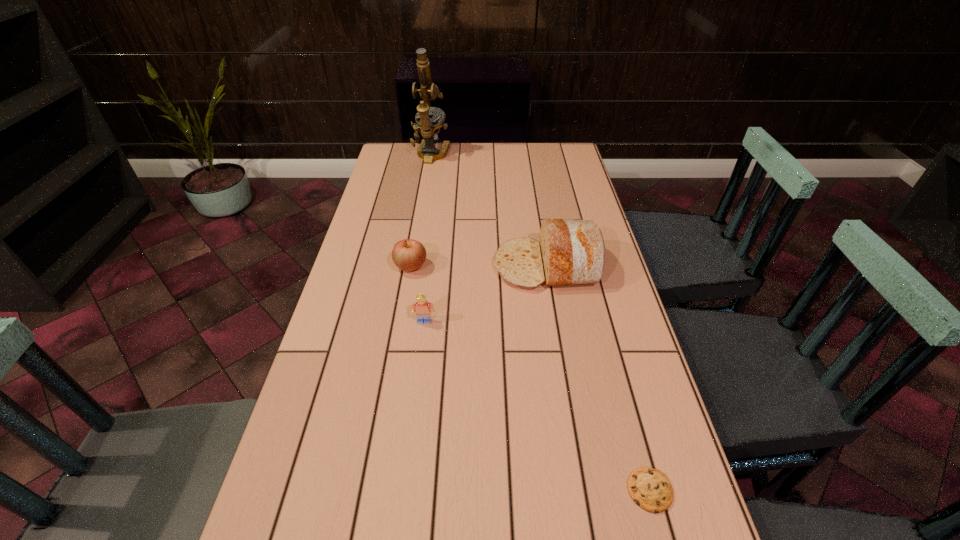
I want to click on unoccupied area between the Lego and the shortest object, so click(537, 406).

Locate an element on the screen. The width and height of the screenshot is (960, 540). vacant point located between the cookie and the apple is located at coordinates (530, 379).

Locate an element on the screen. free space between the Lego and the nearest object is located at coordinates (537, 406).

In order to click on vacant point located between the farthest object and the bread in this screenshot , I will do `click(489, 211)`.

This screenshot has height=540, width=960. Identify the location of free space between the apple and the cookie. (530, 379).

Identify which object is located as the fourth nearest to the second nearest object. Please provide its 2D coordinates. Your answer should be formatted as a tuple, i.e. [(x, y)], where the tuple contains the x and y coordinates of a point satisfying the conditions above.

[(430, 127)]

Identify which object is the closest to the microscope. Please provide its 2D coordinates. Your answer should be formatted as a tuple, i.e. [(x, y)], where the tuple contains the x and y coordinates of a point satisfying the conditions above.

[(571, 252)]

The height and width of the screenshot is (540, 960). I want to click on free space that satisfies the following two spatial constraints: 1. on the front-facing side of the nearest object; 2. on the left side of the Lego, so tap(403, 490).

Locate an element on the screen. The width and height of the screenshot is (960, 540). vacant space that satisfies the following two spatial constraints: 1. on the front-facing side of the shortest object; 2. on the left side of the Lego is located at coordinates (403, 490).

You are a GUI agent. You are given a task and a screenshot of the screen. Output one action in this format:
    pyautogui.click(x=<x>, y=<y>)
    Task: Click on the vacant space that satisfies the following two spatial constraints: 1. on the front-facing side of the nearest object; 2. on the left side of the Lego
    The image size is (960, 540).
    Given the screenshot: What is the action you would take?
    pyautogui.click(x=403, y=490)